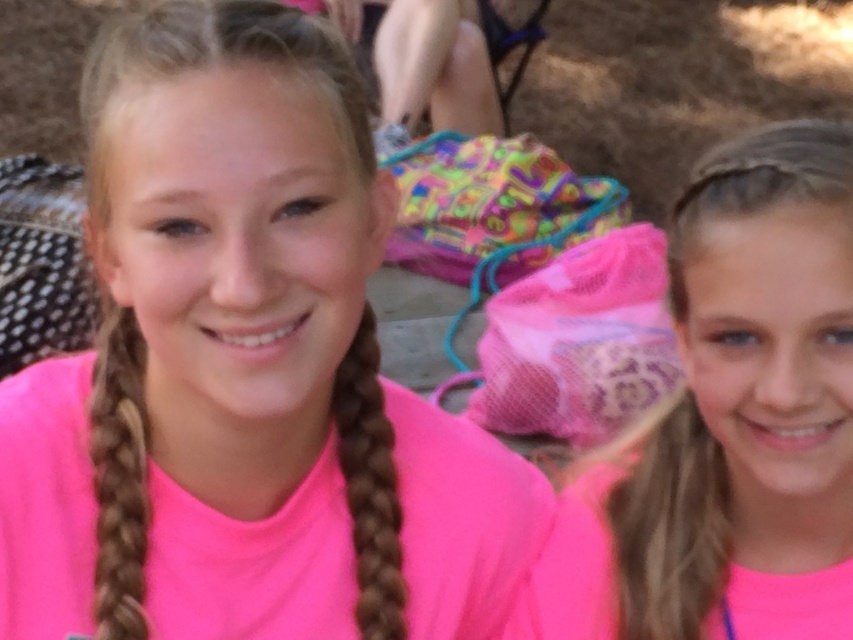
Question: Does pink fabric shirt at center appear on the right side of brownbraided hair at left?

Choices:
 (A) yes
 (B) no

Answer: (B)

Question: Does pink fabric shirt at center appear on the right side of brownbraided hair at left?

Choices:
 (A) yes
 (B) no

Answer: (B)

Question: Based on their relative distances, which object is farther from the pink fabric hair at right?

Choices:
 (A) brown braided hair at center
 (B) pink fabric shirt at center
 (C) brownbraided hair at left

Answer: (C)

Question: Is pink fabric hair at right further to camera compared to brown braided hair at center?

Choices:
 (A) yes
 (B) no

Answer: (B)

Question: Which point is farther to the camera?

Choices:
 (A) pink fabric hair at right
 (B) brown braided hair at center
 (C) pink fabric shirt at center
 (D) brownbraided hair at left

Answer: (B)

Question: Which point is farther from the camera taking this photo?

Choices:
 (A) (410, 547)
 (B) (741, 188)

Answer: (A)